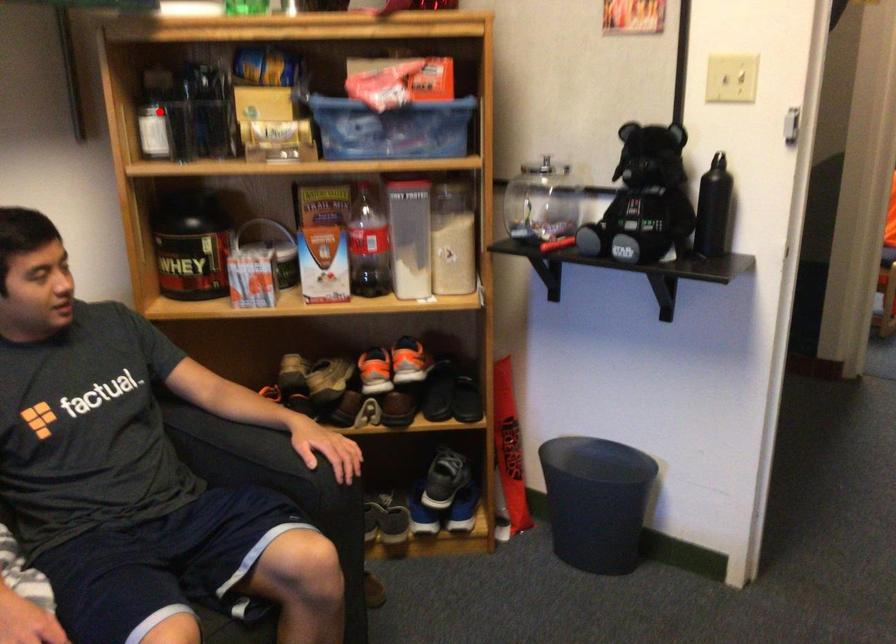
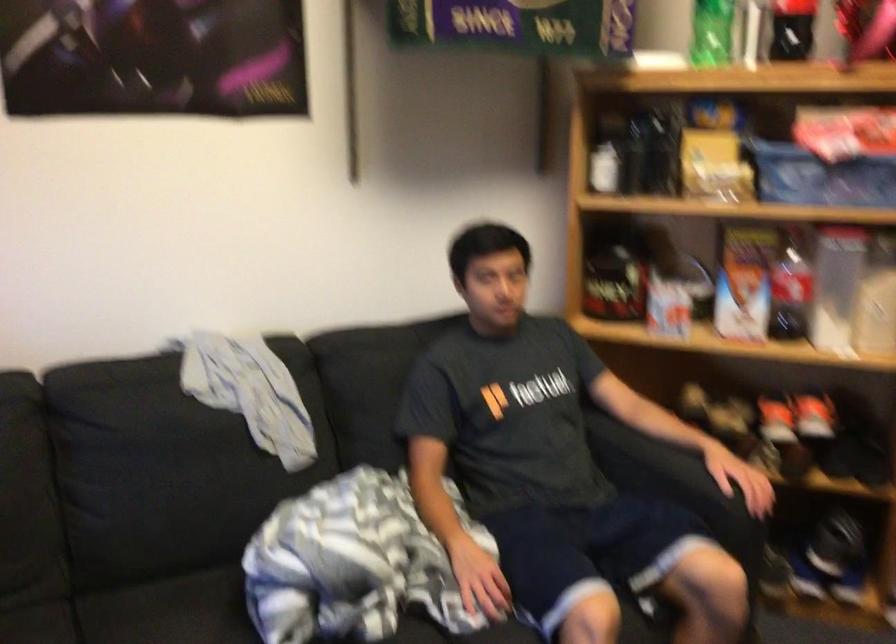
Question: I am providing you with two images of the same scene from different viewpoints. Given a red point in image1, look at the same physical point in image2. Is it:

Choices:
 (A) Closer to the viewpoint
 (B) Farther from the viewpoint

Answer: (B)